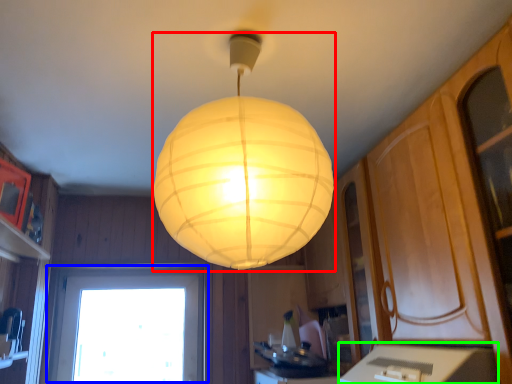
Question: Estimate the real-world distances between objects in this image. Which object is closer to lamp (highlighted by a red box), window (highlighted by a blue box) or counter top (highlighted by a green box)?

Choices:
 (A) window
 (B) counter top

Answer: (B)